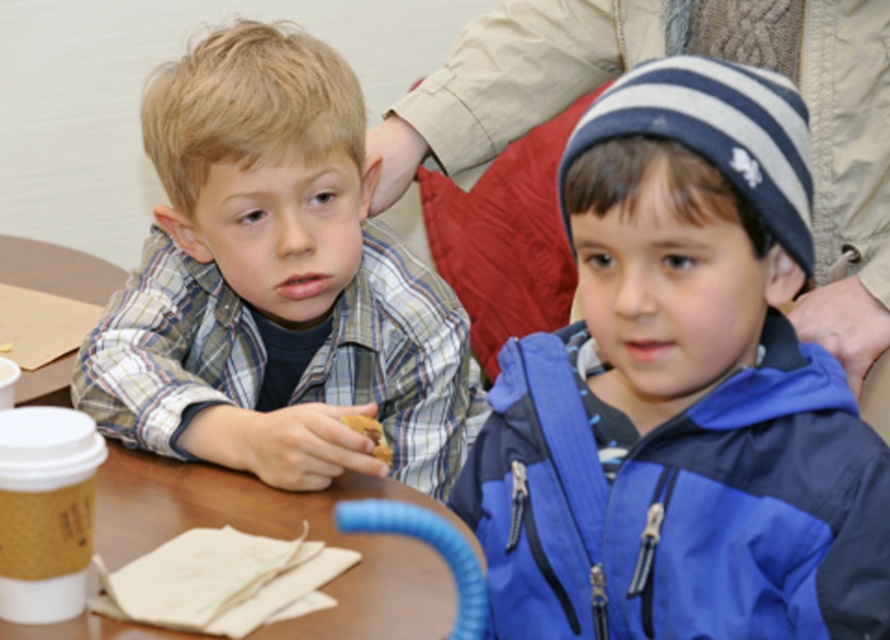
Question: Is plaid shirt at left to the left of brown crumbly cookie at center from the viewer's perspective?

Choices:
 (A) yes
 (B) no

Answer: (A)

Question: Which object is closer to the camera taking this photo?

Choices:
 (A) brown crumbly cookie at center
 (B) blue fleece jacket at center
 (C) brown paper cup at left
 (D) plaid shirt at left

Answer: (B)

Question: Can you confirm if brown paper cup at left is smaller than brown crumbly cookie at center?

Choices:
 (A) yes
 (B) no

Answer: (B)

Question: In this image, where is blue fleece jacket at center located relative to brown crumbly cookie at center?

Choices:
 (A) left
 (B) right

Answer: (B)

Question: Which point is closer to the camera taking this photo?

Choices:
 (A) (712, 90)
 (B) (289, 476)
 (C) (366, 422)

Answer: (A)

Question: Among these objects, which one is nearest to the camera?

Choices:
 (A) plaid shirt at left
 (B) brown paper cup at left
 (C) brown crumbly cookie at center
 (D) blue fleece jacket at center

Answer: (D)